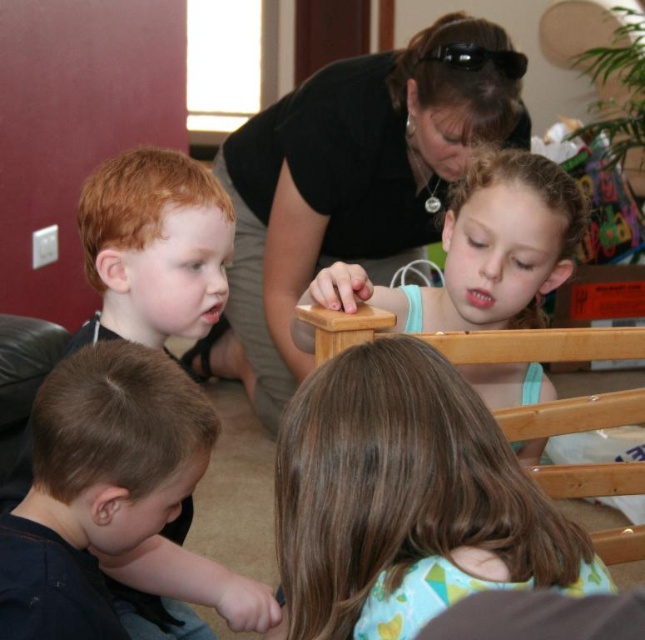
Question: Does black matte shirt at upper center appear under brown smooth shirt at lower left?

Choices:
 (A) yes
 (B) no

Answer: (B)

Question: Is brown smooth shirt at lower left in front of light blue fabric shirt at upper right?

Choices:
 (A) yes
 (B) no

Answer: (A)

Question: Which object appears closest to the camera in this image?

Choices:
 (A) light blue fabric shirt at upper right
 (B) black matte shirt at upper center

Answer: (A)

Question: Which point is closer to the camera?

Choices:
 (A) (571, 193)
 (B) (170, 445)
 (C) (419, 77)

Answer: (B)

Question: Is black matte shirt at upper center further to camera compared to brown smooth shirt at lower left?

Choices:
 (A) no
 (B) yes

Answer: (B)

Question: Which point is closer to the camera taking this photo?

Choices:
 (A) (373, 211)
 (B) (497, 301)

Answer: (B)